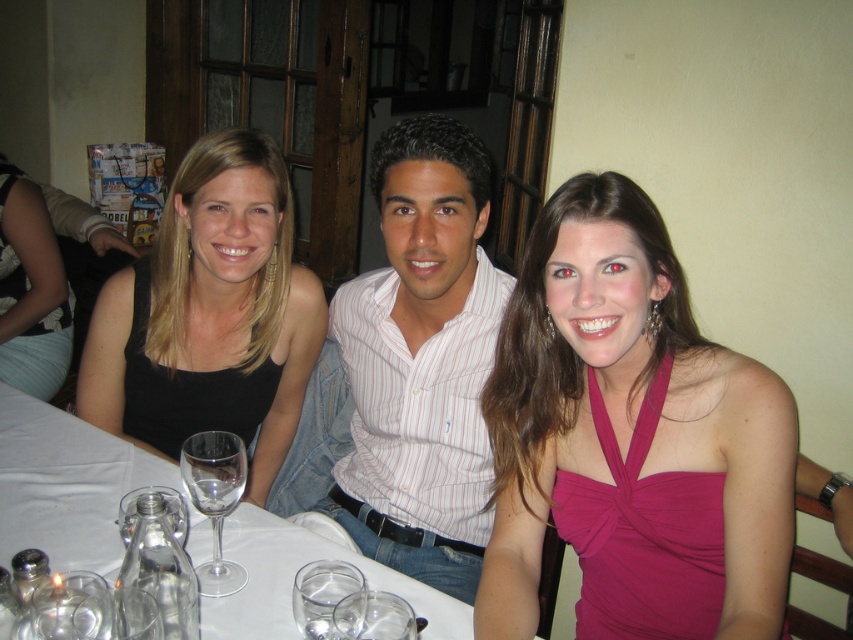
Is white striped shirt at center below transparent glass at table?

No.

Locate an element on the screen. The image size is (853, 640). white striped shirt at center is located at coordinates (421, 362).

Between point (343, 518) and point (412, 612), which one is positioned behind?

Point (343, 518)

Find the location of `white striped shirt at center`. white striped shirt at center is located at coordinates tap(421, 362).

Is point (56, 433) positioned in front of point (233, 484)?

No, (56, 433) is behind (233, 484).

What do you see at coordinates (67, 484) in the screenshot? The height and width of the screenshot is (640, 853). I see `white glass at center` at bounding box center [67, 484].

Is point (109, 513) closer to camera compared to point (196, 444)?

No, it is behind (196, 444).

Find the location of a particular element. white glass at center is located at coordinates (67, 484).

Between white glass at center and transparent glass at table, which one is positioned lower?

transparent glass at table is below.

Locate an element on the screen. Image resolution: width=853 pixels, height=640 pixels. white glass at center is located at coordinates (67, 484).

Locate an element on the screen. white glass at center is located at coordinates (67, 484).